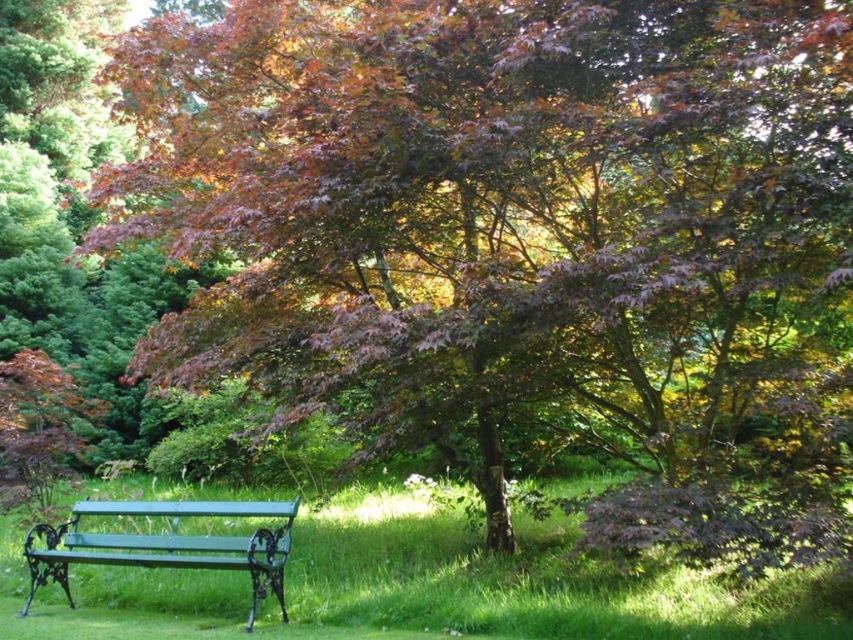
Question: Which point appears farthest from the camera in this image?

Choices:
 (A) (250, 616)
 (B) (395, 512)

Answer: (B)

Question: Which object is farther from the camera taking this photo?

Choices:
 (A) green painted metal bench at lower left
 (B) green grass at lower left

Answer: (A)

Question: Is green grass at lower left bigger than green painted metal bench at lower left?

Choices:
 (A) yes
 (B) no

Answer: (B)

Question: Can you confirm if green grass at lower left is smaller than green painted metal bench at lower left?

Choices:
 (A) no
 (B) yes

Answer: (B)

Question: Which object is closer to the camera taking this photo?

Choices:
 (A) green grass at lower left
 (B) green painted metal bench at lower left

Answer: (A)

Question: Can you confirm if green grass at lower left is bigger than green painted metal bench at lower left?

Choices:
 (A) yes
 (B) no

Answer: (B)